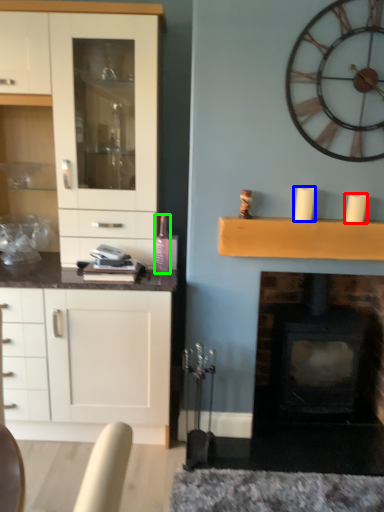
Question: Considering the real-world distances, which object is farthest from candle (highlighted by a red box)? candle (highlighted by a blue box) or bottle (highlighted by a green box)?

Choices:
 (A) candle
 (B) bottle

Answer: (B)